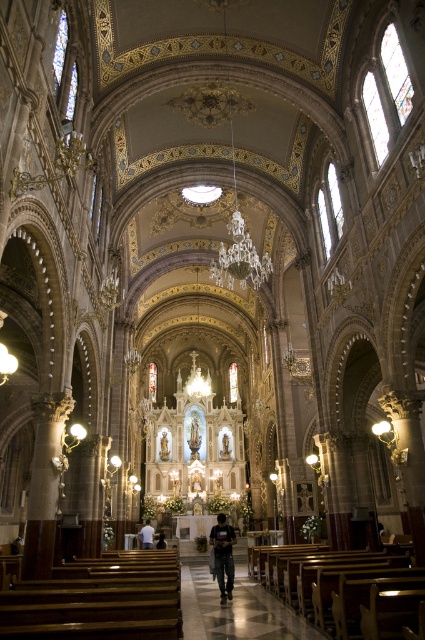
Question: Can you confirm if black cotton shirt at center is positioned to the left of white fabric shirt at center?

Choices:
 (A) yes
 (B) no

Answer: (B)

Question: Does black cotton shirt at center come behind white fabric shirt at center?

Choices:
 (A) no
 (B) yes

Answer: (A)

Question: Among these objects, which one is nearest to the camera?

Choices:
 (A) black cotton shirt at center
 (B) white fabric shirt at center
 (C) wooden polished aisle at center

Answer: (C)

Question: Does wooden polished aisle at center have a smaller size compared to white fabric shirt at center?

Choices:
 (A) yes
 (B) no

Answer: (B)

Question: Among these objects, which one is farthest from the camera?

Choices:
 (A) white fabric shirt at center
 (B) wooden polished aisle at center
 (C) black cotton shirt at center

Answer: (A)

Question: Which point appears closest to the camera in this image?

Choices:
 (A) (193, 634)
 (B) (150, 541)

Answer: (A)